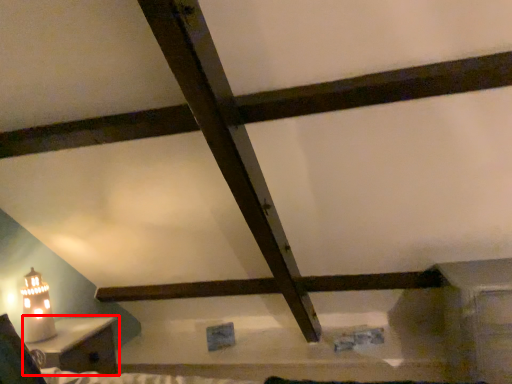
Question: From the image's perspective, where is furniture (annotated by the red box) located relative to table lamp?

Choices:
 (A) above
 (B) below

Answer: (B)